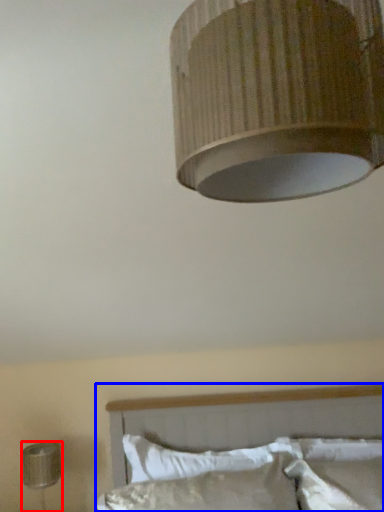
Question: Which object is closer to the camera taking this photo, lamp (highlighted by a red box) or bed (highlighted by a blue box)?

Choices:
 (A) lamp
 (B) bed

Answer: (B)